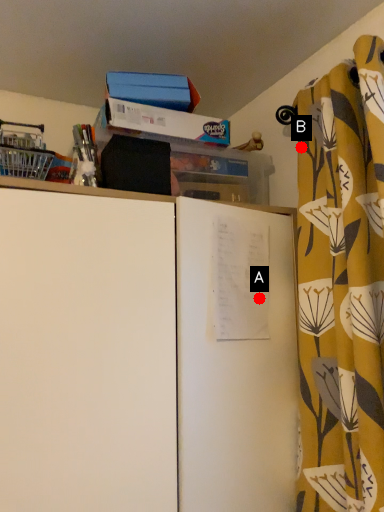
Question: Two points are circled on the image, labeled by A and B beside each circle. Which point is closer to the camera?

Choices:
 (A) A is closer
 (B) B is closer

Answer: (A)